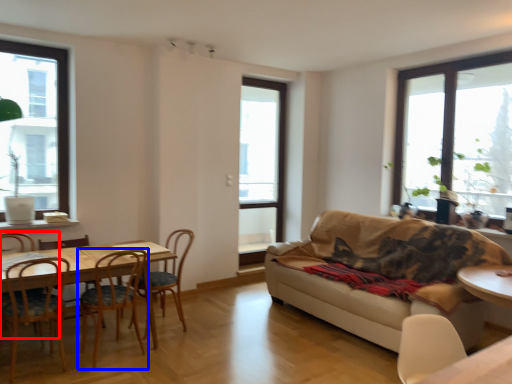
Question: Among these objects, which one is farthest to the camera, chair (highlighted by a red box) or chair (highlighted by a blue box)?

Choices:
 (A) chair
 (B) chair

Answer: (A)